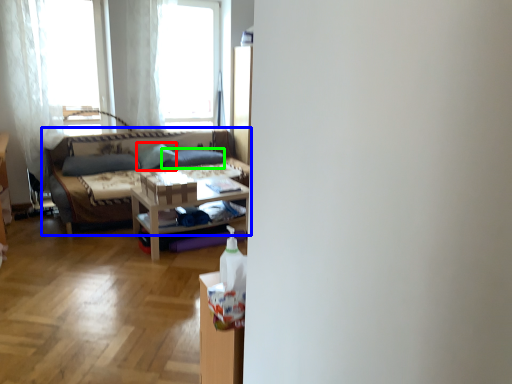
Question: Which is nearer to the pillow (highlighted by a red box)? studio couch (highlighted by a blue box) or pillow (highlighted by a green box).

Choices:
 (A) studio couch
 (B) pillow

Answer: (B)